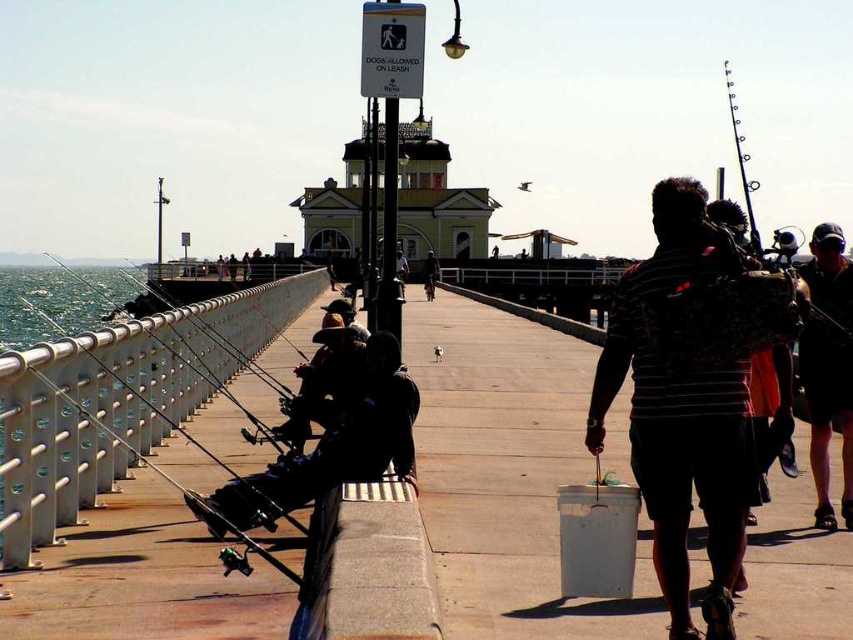
You are a person standing on the pier and want to check the water below your dark blue jeans at center. Is the clear water at railing left visible from your current position?

The clear water at railing left is located below the dark blue jeans at center, so yes, the clear water at railing left is visible from your current position.

You are a photographer trying to capture a candid shot of the striped cotton shirt at center and the dark blue jeans at center. Since you want to ensure both are clearly visible, which one should you focus on first to account for their sizes?

The striped cotton shirt at center is bigger than dark blue jeans at center, so you should focus on the striped cotton shirt at center first as it takes up more space in the frame.

You are standing on the pier and want to walk to the edge to cast your fishing line. You see the clear water at railing left and the dark blue jeans at center. Which object is closer to you as you move towards the edge?

The clear water at railing left is closer to you as you move towards the edge because it is in front of the dark blue jeans at center.